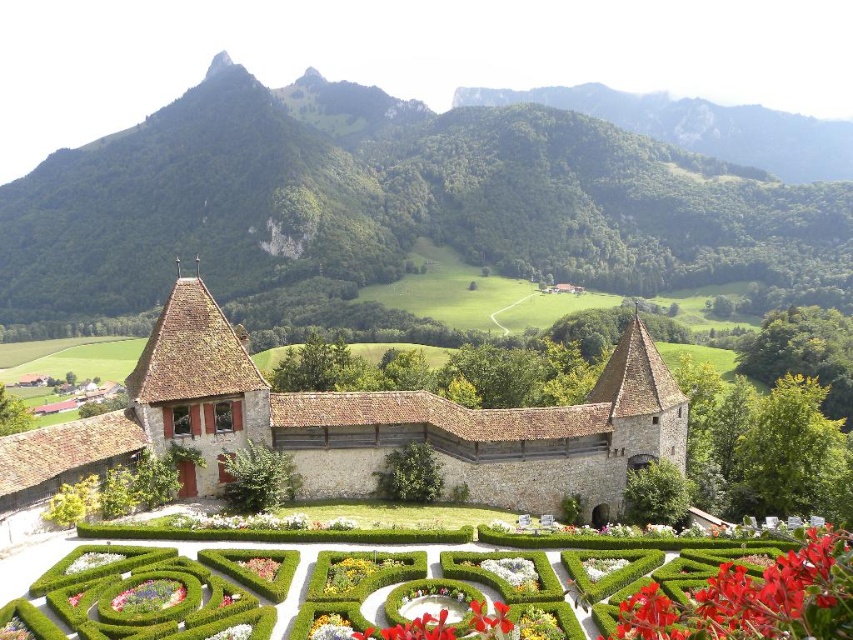
You are standing at the entrance of the castle and want to reach the green hedge maze at center. According to the coordinates provided, is the maze located closer to the castle walls or the garden entrance?

The green hedge maze at center is located closer to the garden entrance because its coordinates are at point (757, 600), which places it near the edge of the scene rather than near the castle walls.

You are an artist planning to paint the scene of the historic stone castle. You want to ensure that the green forested mountain at upper center and the red matte flower at lower right are proportionally accurate. Which object should you paint larger?

The green forested mountain at upper center should be painted larger because it is larger in size than the red matte flower at lower right according to the description.

You are a visitor standing at the entrance of the castle garden. You see the green hedge maze at center and the matte green hedge at lower left. Which of these two objects is positioned higher up in the garden layout?

The green hedge maze at center is positioned higher up in the garden layout because it is located above the matte green hedge at lower left.